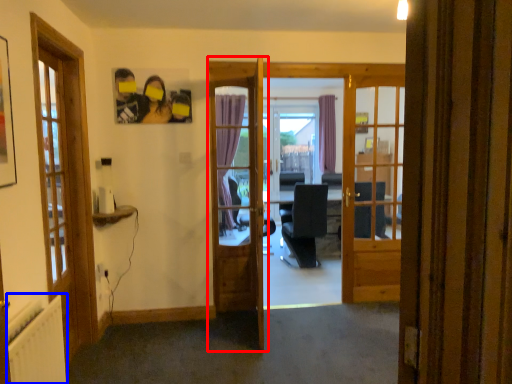
Question: Which object appears closest to the camera in this image, door (highlighted by a red box) or radiator (highlighted by a blue box)?

Choices:
 (A) door
 (B) radiator

Answer: (B)